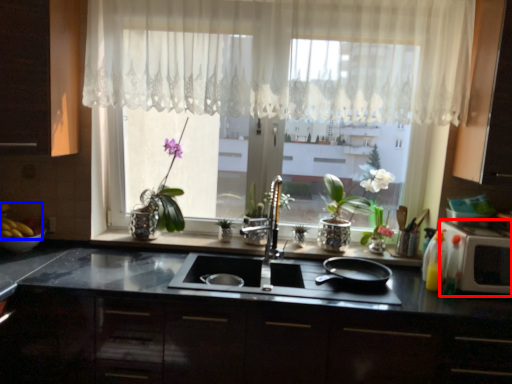
Question: Which point is closer to the camera, appliance (highlighted by a red box) or food (highlighted by a blue box)?

Choices:
 (A) appliance
 (B) food

Answer: (A)